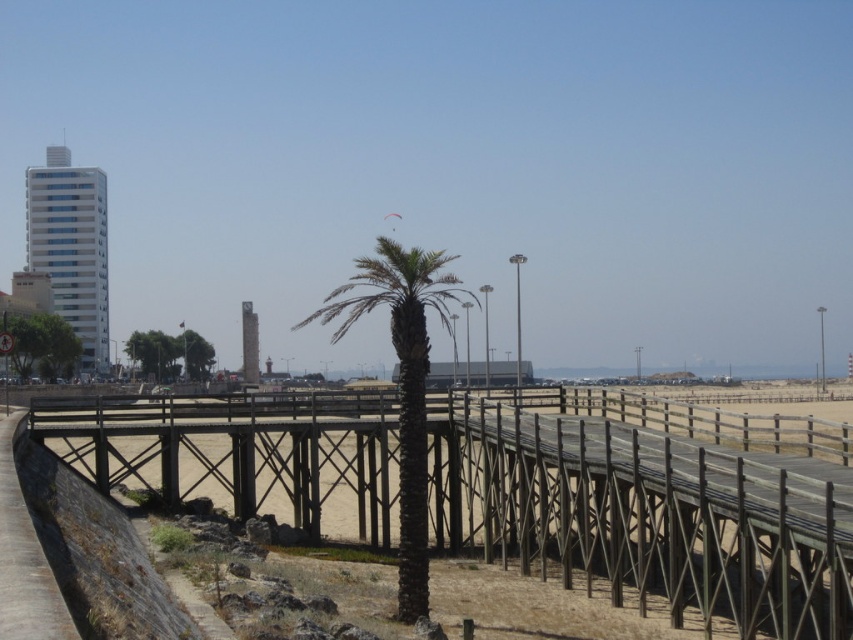
You are standing at the wooden walkway and want to reach both the point at coordinates point (734, 500) and the point at coordinates point (407, 292). Which point will you reach first if you start walking from the walkway?

You will reach point (734, 500) first because it is closer to the viewer than point (407, 292).

You are a painter who wants to capture the scene accurately. You have a canvas that can only fit objects up to the width of the brown wooden path at lower left. Can you fit the dark brown wood palm tree at center on your canvas?

The dark brown wood palm tree at center is wider than the brown wooden path at lower left, so it cannot fit on the canvas designed for the path width.